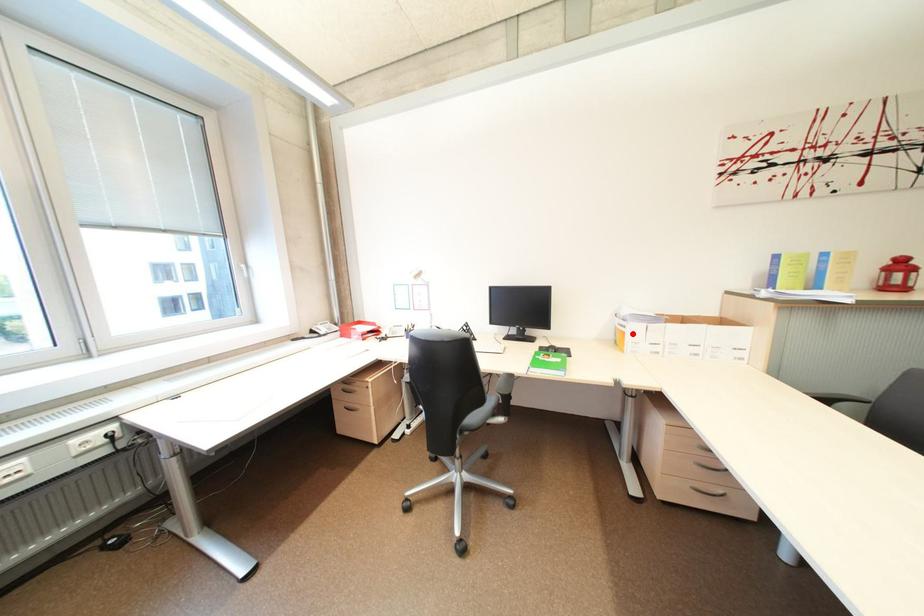
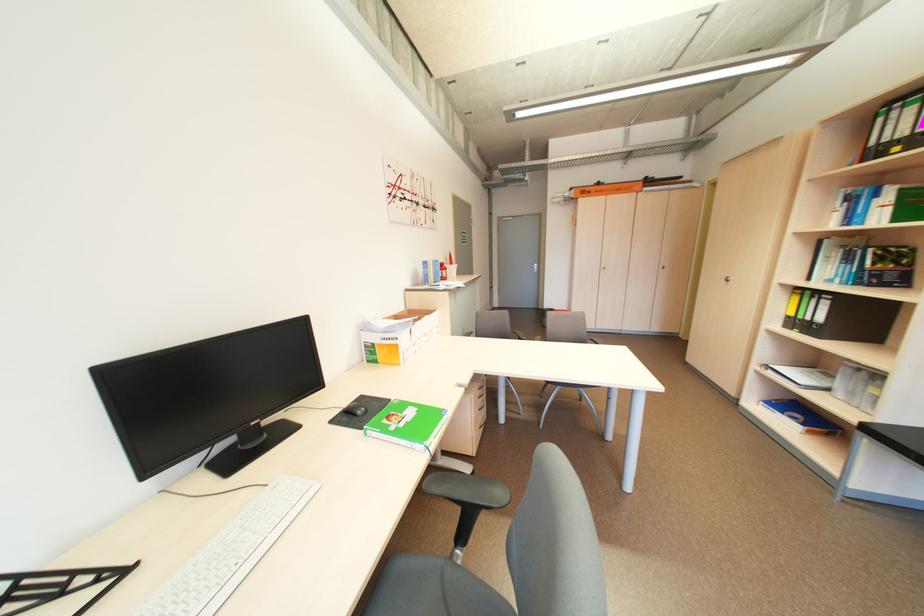
Locate, in the second image, the point that corresponds to the highlighted location in the first image.

(406, 347)